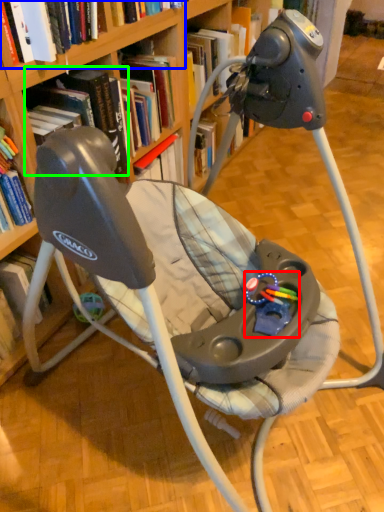
Question: Which object is the closest to the toy (highlighted by a red box)? Choose among these: book (highlighted by a blue box) or book (highlighted by a green box).

Choices:
 (A) book
 (B) book

Answer: (B)